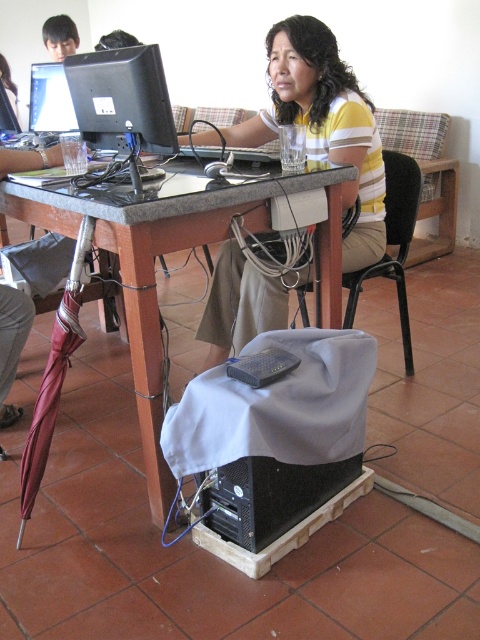
Is point (61, 120) positioned before point (250, 378)?

No.

Does matte black monitor at upper left appear on the left side of black plastic keyboard at lower center?

Yes, matte black monitor at upper left is to the left of black plastic keyboard at lower center.

Image resolution: width=480 pixels, height=640 pixels. Identify the location of matte black monitor at upper left. (49, 99).

From the picture: Which of these two, wooden table at center or smooth skin face at upper left, stands taller?

With more height is wooden table at center.

Which is behind, point (142, 237) or point (60, 38)?

The point (60, 38) is more distant.

Where is `wooden table at center`? This screenshot has width=480, height=640. wooden table at center is located at coordinates (154, 269).

The height and width of the screenshot is (640, 480). I want to click on wooden table at center, so click(x=154, y=269).

Between wooden table at center and matte black monitor at upper left, which one is positioned higher?

Positioned higher is matte black monitor at upper left.

Is point (312, 182) less distant than point (44, 65)?

Yes, point (312, 182) is closer to viewer.

Where is `wooden table at center`? This screenshot has width=480, height=640. wooden table at center is located at coordinates (154, 269).